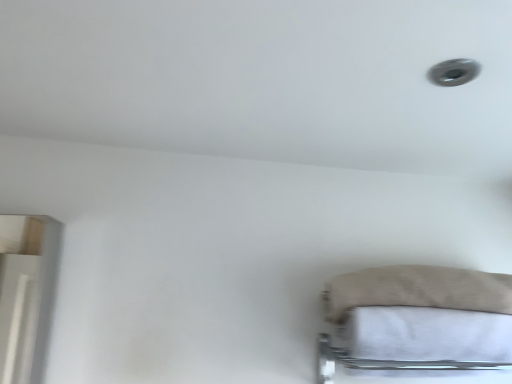
Question: Considering the relative sizes of beige fabric pillow at lower right and white cotton sheet at lower right in the image provided, is beige fabric pillow at lower right bigger than white cotton sheet at lower right?

Choices:
 (A) yes
 (B) no

Answer: (A)

Question: Considering the relative sizes of beige fabric pillow at lower right and white cotton sheet at lower right in the image provided, is beige fabric pillow at lower right wider than white cotton sheet at lower right?

Choices:
 (A) no
 (B) yes

Answer: (A)

Question: Is beige fabric pillow at lower right outside of white cotton sheet at lower right?

Choices:
 (A) yes
 (B) no

Answer: (A)

Question: Considering the relative sizes of beige fabric pillow at lower right and white cotton sheet at lower right in the image provided, is beige fabric pillow at lower right taller than white cotton sheet at lower right?

Choices:
 (A) no
 (B) yes

Answer: (A)

Question: Considering the relative positions of beige fabric pillow at lower right and white cotton sheet at lower right in the image provided, is beige fabric pillow at lower right to the left of white cotton sheet at lower right from the viewer's perspective?

Choices:
 (A) yes
 (B) no

Answer: (A)

Question: Is beige fabric pillow at lower right to the right of white cotton sheet at lower right from the viewer's perspective?

Choices:
 (A) no
 (B) yes

Answer: (A)

Question: Is white cotton sheet at lower right at the right side of beige fabric pillow at lower right?

Choices:
 (A) yes
 (B) no

Answer: (A)

Question: Is white cotton sheet at lower right bigger than beige fabric pillow at lower right?

Choices:
 (A) yes
 (B) no

Answer: (B)

Question: Is white cotton sheet at lower right further to camera compared to beige fabric pillow at lower right?

Choices:
 (A) no
 (B) yes

Answer: (A)

Question: Could you tell me if white cotton sheet at lower right is facing beige fabric pillow at lower right?

Choices:
 (A) no
 (B) yes

Answer: (A)

Question: Is white cotton sheet at lower right shorter than beige fabric pillow at lower right?

Choices:
 (A) no
 (B) yes

Answer: (A)

Question: Does white cotton sheet at lower right have a lesser width compared to beige fabric pillow at lower right?

Choices:
 (A) no
 (B) yes

Answer: (A)

Question: In terms of size, does beige fabric pillow at lower right appear bigger or smaller than white cotton sheet at lower right?

Choices:
 (A) small
 (B) big

Answer: (B)